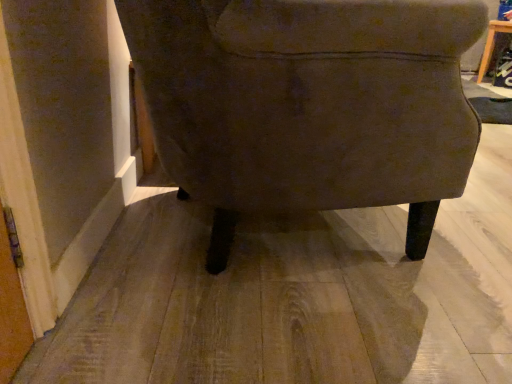
What do you see at coordinates (308, 104) in the screenshot?
I see `matte brown fabric chair at center` at bounding box center [308, 104].

Find the location of `matte brown fabric chair at center`. matte brown fabric chair at center is located at coordinates (308, 104).

You are a GUI agent. You are given a task and a screenshot of the screen. Output one action in this format:
    pyautogui.click(x=<x>, y=<y>)
    Task: Click on the wooden table at upper right
    
    Given the screenshot: What is the action you would take?
    pyautogui.click(x=490, y=45)

Describe the element at coordinates (490, 45) in the screenshot. I see `wooden table at upper right` at that location.

Find the location of a particular element. matte brown fabric chair at center is located at coordinates (308, 104).

Which is more to the left, wooden table at upper right or matte brown fabric chair at center?

matte brown fabric chair at center is more to the left.

Is the position of wooden table at upper right less distant than that of matte brown fabric chair at center?

No, it is behind matte brown fabric chair at center.

Which is in front, point (494, 40) or point (311, 1)?

Point (311, 1)

Consider the image. From the image's perspective, is wooden table at upper right located above or below matte brown fabric chair at center?

From the image's perspective, wooden table at upper right appears above matte brown fabric chair at center.

From a real-world perspective, is wooden table at upper right beneath matte brown fabric chair at center?

Yes, from a real-world perspective, wooden table at upper right is under matte brown fabric chair at center.

Which of these two, wooden table at upper right or matte brown fabric chair at center, is thinner?

Thinner between the two is wooden table at upper right.

Between wooden table at upper right and matte brown fabric chair at center, which one has less height?

With less height is wooden table at upper right.

Considering the sizes of objects wooden table at upper right and matte brown fabric chair at center in the image provided, who is bigger, wooden table at upper right or matte brown fabric chair at center?

With larger size is matte brown fabric chair at center.

Choose the correct answer: Is wooden table at upper right inside matte brown fabric chair at center or outside it?

wooden table at upper right lies outside matte brown fabric chair at center.

Is wooden table at upper right in contact with matte brown fabric chair at center?

No, wooden table at upper right is not making contact with matte brown fabric chair at center.

Is wooden table at upper right aimed at matte brown fabric chair at center?

Yes, wooden table at upper right is oriented towards matte brown fabric chair at center.

How many degrees apart are the facing directions of wooden table at upper right and matte brown fabric chair at center?

The angle between the facing direction of wooden table at upper right and the facing direction of matte brown fabric chair at center is 142 degrees.

How much distance is there between wooden table at upper right and matte brown fabric chair at center?

wooden table at upper right and matte brown fabric chair at center are 9.17 feet apart from each other.

There is a wooden table at upper right. Where is `chair above it (from a real-world perspective)`? The height and width of the screenshot is (384, 512). chair above it (from a real-world perspective) is located at coordinates (308, 104).

Visually, is matte brown fabric chair at center positioned to the left or to the right of wooden table at upper right?

matte brown fabric chair at center is positioned on wooden table at upper right's left side.

Looking at this image, is matte brown fabric chair at center in front of or behind wooden table at upper right in the image?

Visually, matte brown fabric chair at center is located in front of wooden table at upper right.

Which is closer, (303, 3) or (511, 23)?

Point (303, 3) is closer to the camera than point (511, 23).

From the image's perspective, is matte brown fabric chair at center positioned above or below wooden table at upper right?

Based on their image positions, matte brown fabric chair at center is located beneath wooden table at upper right.

From a real-world perspective, between matte brown fabric chair at center and wooden table at upper right, who is vertically lower?

In real-world perspective, wooden table at upper right is lower.

Considering the sizes of matte brown fabric chair at center and wooden table at upper right in the image, is matte brown fabric chair at center wider or thinner than wooden table at upper right?

Considering their sizes, matte brown fabric chair at center looks broader than wooden table at upper right.

Which of these two, matte brown fabric chair at center or wooden table at upper right, stands shorter?

Standing shorter between the two is wooden table at upper right.

Consider the image. Which of these two, matte brown fabric chair at center or wooden table at upper right, is smaller?

wooden table at upper right.

Do you think matte brown fabric chair at center is within wooden table at upper right, or outside of it?

matte brown fabric chair at center cannot be found inside wooden table at upper right.

Are matte brown fabric chair at center and wooden table at upper right making contact?

No, matte brown fabric chair at center is not beside wooden table at upper right.

Is matte brown fabric chair at center oriented away from wooden table at upper right?

No, matte brown fabric chair at center's orientation is not away from wooden table at upper right.

Locate an element on the screen. table lying on the right of matte brown fabric chair at center is located at coordinates (490, 45).

Locate an element on the screen. This screenshot has height=384, width=512. table that is on the right side of matte brown fabric chair at center is located at coordinates (490, 45).

This screenshot has height=384, width=512. What are the coordinates of `chair that is in front of the wooden table at upper right` in the screenshot? It's located at (308, 104).